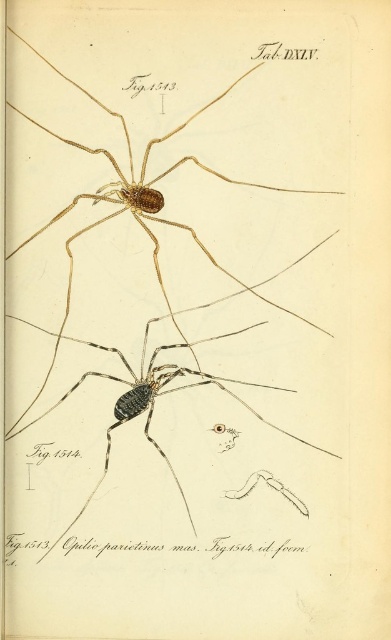
Does brown matte spider at upper center come in front of dark brown matte spider at center?

Yes, brown matte spider at upper center is closer to the viewer.

This screenshot has height=640, width=391. Describe the element at coordinates (152, 259) in the screenshot. I see `brown matte spider at upper center` at that location.

Find the location of a particular element. brown matte spider at upper center is located at coordinates (152, 259).

At what (x,y) coordinates should I click in order to perform the action: click on brown matte spider at upper center. Please return your answer as a coordinate pair (x, y). Looking at the image, I should click on (152, 259).